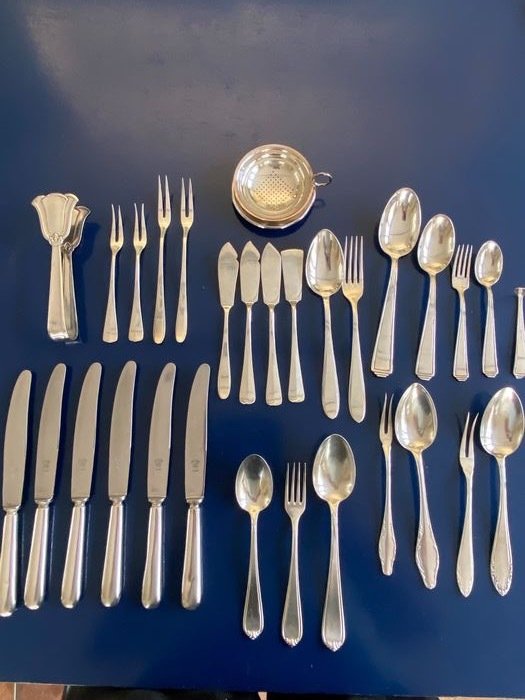
The width and height of the screenshot is (525, 700). Find the location of `butter knife`. butter knife is located at coordinates (9, 497), (44, 494), (77, 498), (117, 498), (156, 493), (193, 491).